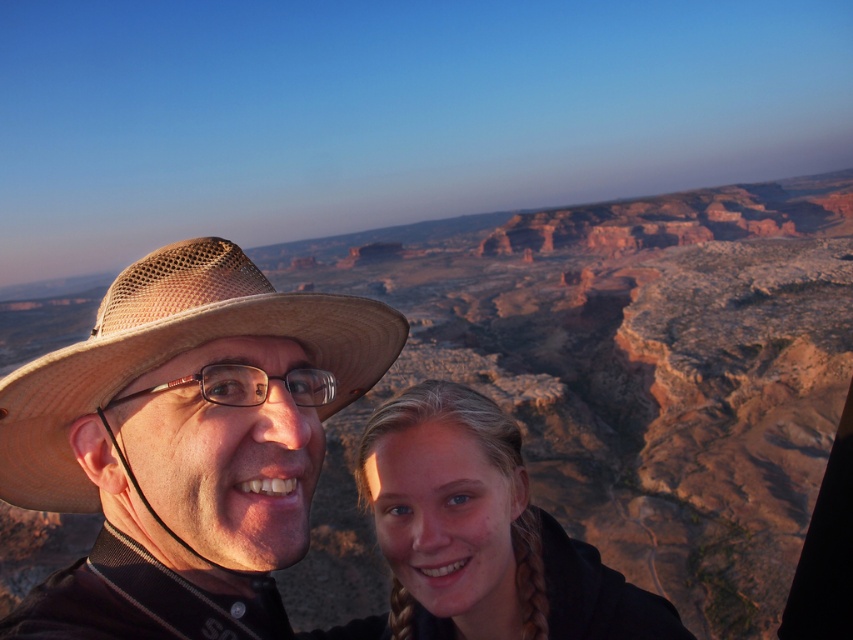
You are a photographer trying to capture both the matte straw hat at left and the blonde hair at lower center in a single frame. Given that your camera has a fixed focal length and limited depth of field, which object should you focus on to ensure the larger one is in sharp focus while the smaller one is slightly blurred?

The matte straw hat at left is larger than the blonde hair at lower center, so you should focus on the matte straw hat at left to ensure it is in sharp focus while the smaller blonde hair at lower center appears slightly blurred.

You are a photographer trying to capture a photo of both the matte straw hat at left and the clear plastic glasses at center in the same frame. Given that your camera has a focal length of 50mm and the minimum distance between objects in the frame needs to be at least 5 meters to ensure both are in focus, will you be able to achieve this?

The matte straw hat at left and clear plastic glasses at center are 4.80 meters apart from each other. Since the minimum required distance is 5 meters, the photographer cannot capture both in focus with the current setup.